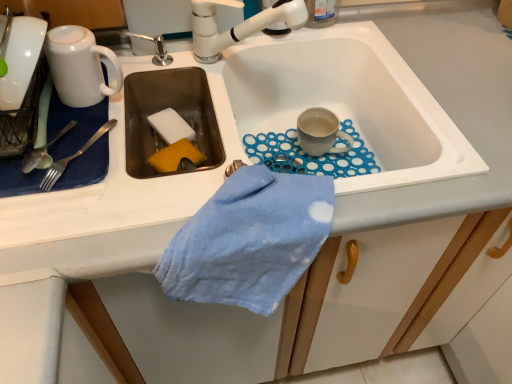
At what (x,y) coordinates should I click in order to perform the action: click on unoccupied area in front of satin silver fork at left, the first silverware from the right. Please return your answer as a coordinate pair (x, y). The width and height of the screenshot is (512, 384). Looking at the image, I should click on tap(70, 219).